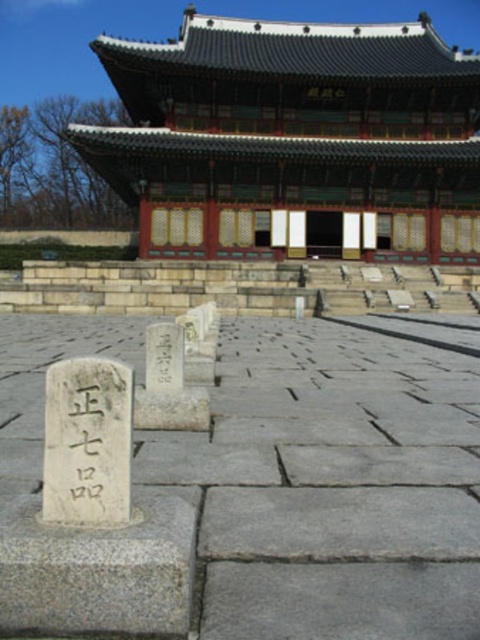
Between white stone marker at center and black stone writing at lower left, which one has less height?

black stone writing at lower left

Measure the distance between point (424, 468) and camera.

Point (424, 468) and camera are 10.31 feet apart from each other.

Where is `white stone marker at center`? The height and width of the screenshot is (640, 480). white stone marker at center is located at coordinates (331, 484).

Does white stone marker at center come behind green wooden palace at upper center?

No.

Which is in front, point (415, 580) or point (156, 230)?

Point (415, 580) is in front.

What are the coordinates of `white stone marker at center` in the screenshot? It's located at (331, 484).

How distant is green wooden palace at upper center from black stone writing at center?

green wooden palace at upper center and black stone writing at center are 31.76 meters apart.

Locate an element on the screen. This screenshot has height=640, width=480. green wooden palace at upper center is located at coordinates (294, 140).

At what (x,y) coordinates should I click in order to perform the action: click on green wooden palace at upper center. Please return your answer as a coordinate pair (x, y). Looking at the image, I should click on (294, 140).